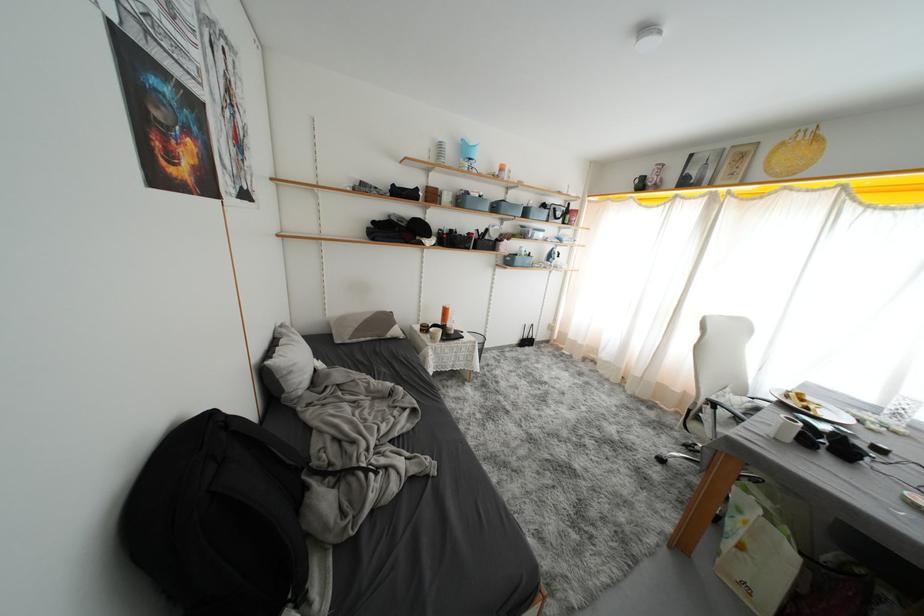
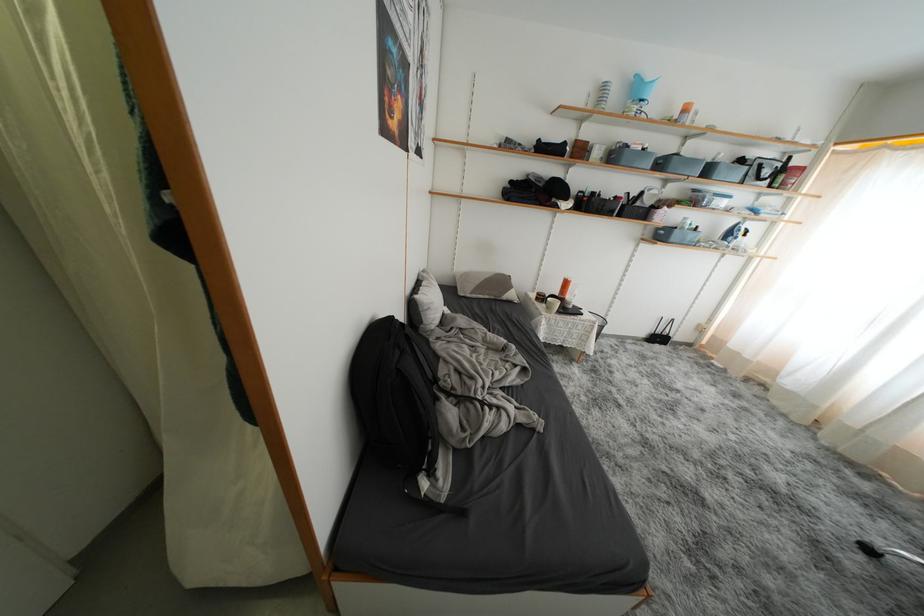
The point at (532, 217) is marked in the first image. Where is the corresponding point in the second image?

(714, 175)